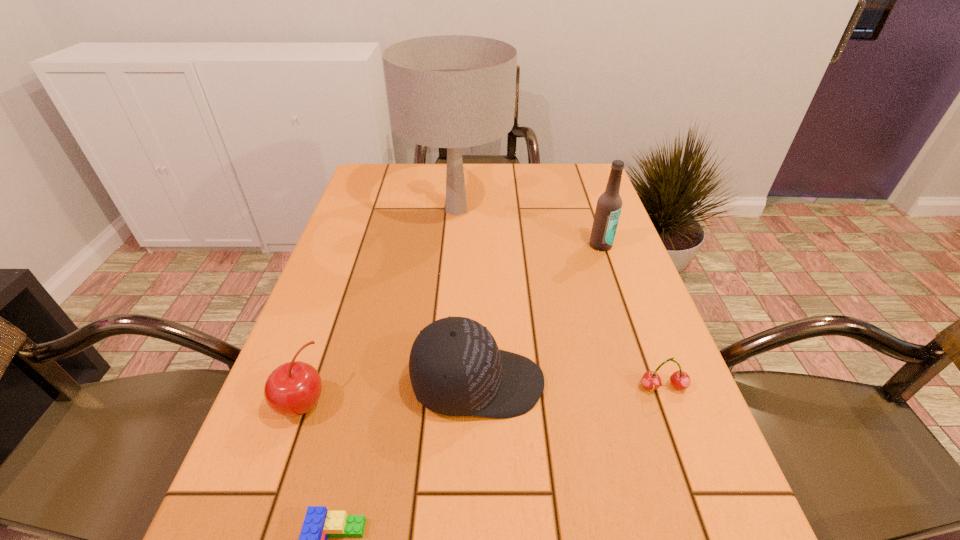
The image size is (960, 540). I want to click on the tallest object, so click(448, 91).

This screenshot has width=960, height=540. What are the coordinates of `beer bottle` in the screenshot? It's located at (608, 209).

Find the location of a particular element. The image size is (960, 540). baseball cap is located at coordinates (456, 369).

This screenshot has width=960, height=540. Find the location of `the fourth tallest object`. the fourth tallest object is located at coordinates (292, 389).

Where is `the taller cherry`? The width and height of the screenshot is (960, 540). the taller cherry is located at coordinates (292, 389).

Identify the location of the second shortest object. (680, 380).

At what (x,y) coordinates should I click in order to perform the action: click on the shorter cherry. Please return your answer as a coordinate pair (x, y). This screenshot has height=540, width=960. Looking at the image, I should click on (680, 380).

In order to click on free space located on the front-facing side of the tallest object in this screenshot , I will do `click(450, 296)`.

Locate an element on the screen. The image size is (960, 540). vacant position located on the side of the second tallest object with the label is located at coordinates (624, 312).

At what (x,y) coordinates should I click in order to perform the action: click on vacant space located 0.160m at the front of the baseball cap where the brim is located. Please return your answer as a coordinate pair (x, y). The image size is (960, 540). Looking at the image, I should click on coord(627,383).